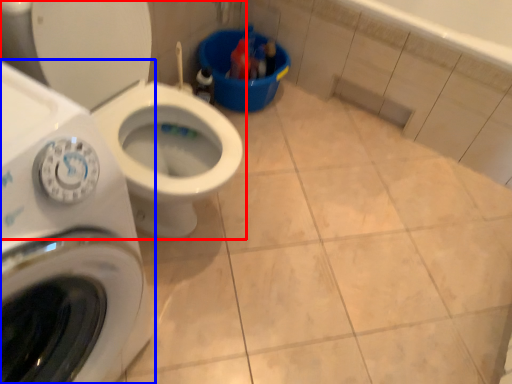
Question: Which object appears closest to the camera in this image, toilet (highlighted by a red box) or washing machine (highlighted by a blue box)?

Choices:
 (A) toilet
 (B) washing machine

Answer: (B)